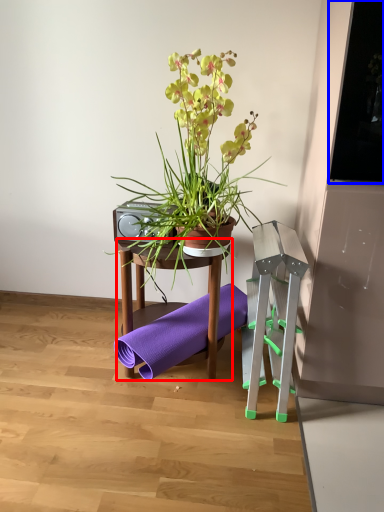
Question: Among these objects, which one is farthest to the camera, table (highlighted by a red box) or window screen (highlighted by a blue box)?

Choices:
 (A) table
 (B) window screen

Answer: (A)